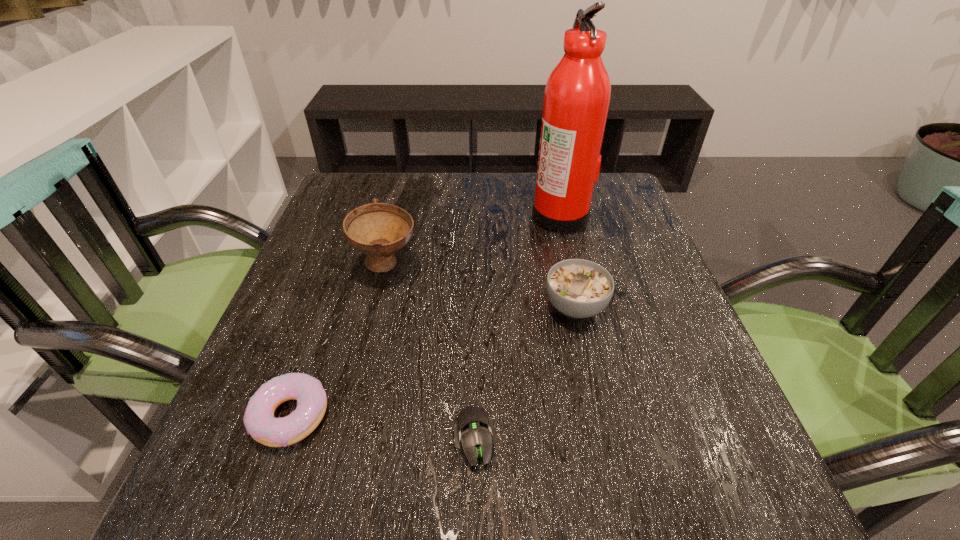
Find the location of a particular element. blank region between the second shortest object and the left soup bowl is located at coordinates tap(338, 340).

What are the coordinates of `vacant space that is in between the tallest object and the left soup bowl` in the screenshot? It's located at (473, 240).

The image size is (960, 540). In order to click on vacant area between the farthest object and the computer mouse in this screenshot , I will do `click(517, 327)`.

You are a GUI agent. You are given a task and a screenshot of the screen. Output one action in this format:
    pyautogui.click(x=<x>, y=<y>)
    Task: Click on the unoccupied area between the fire extinguisher and the taller soup bowl
    The height and width of the screenshot is (540, 960).
    Given the screenshot: What is the action you would take?
    pyautogui.click(x=473, y=240)

Locate an element on the screen. The width and height of the screenshot is (960, 540). empty space that is in between the left soup bowl and the farthest object is located at coordinates (473, 240).

Image resolution: width=960 pixels, height=540 pixels. I want to click on vacant space that is in between the shortest object and the right soup bowl, so click(x=525, y=373).

At what (x,y) coordinates should I click in order to perform the action: click on unoccupied position between the shortest object and the fourth tallest object. Please return your answer as a coordinate pair (x, y). The height and width of the screenshot is (540, 960). Looking at the image, I should click on (383, 428).

Locate an element on the screen. This screenshot has width=960, height=540. free space between the fire extinguisher and the second tallest object is located at coordinates (473, 240).

Locate which object is the fourth closest to the farthest object. Please provide its 2D coordinates. Your answer should be formatted as a tuple, i.e. [(x, y)], where the tuple contains the x and y coordinates of a point satisfying the conditions above.

[(260, 423)]

You are a GUI agent. You are given a task and a screenshot of the screen. Output one action in this format:
    pyautogui.click(x=<x>, y=<y>)
    Task: Click on the object that stands as the closest to the shorter soup bowl
    This screenshot has width=960, height=540.
    Given the screenshot: What is the action you would take?
    pyautogui.click(x=578, y=91)